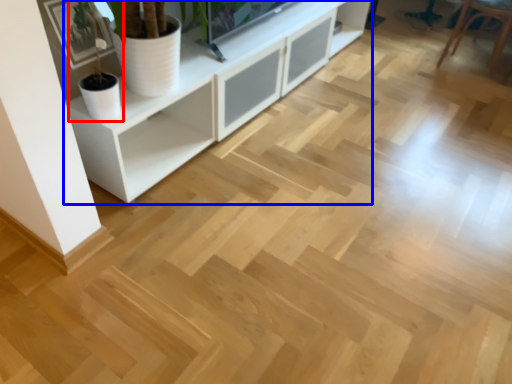
Question: Which point is closer to the camera, houseplant (highlighted by a red box) or cabinetry (highlighted by a blue box)?

Choices:
 (A) houseplant
 (B) cabinetry

Answer: (B)